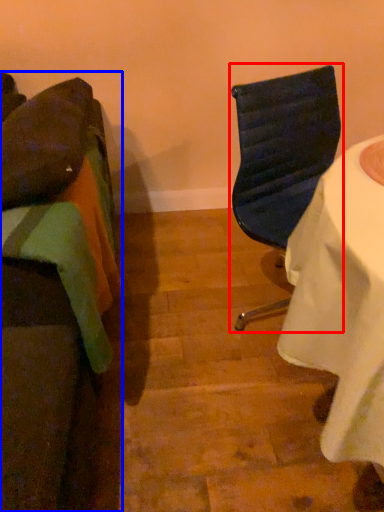
Question: Among these objects, which one is nearest to the camera, chair (highlighted by a red box) or chair (highlighted by a blue box)?

Choices:
 (A) chair
 (B) chair

Answer: (B)